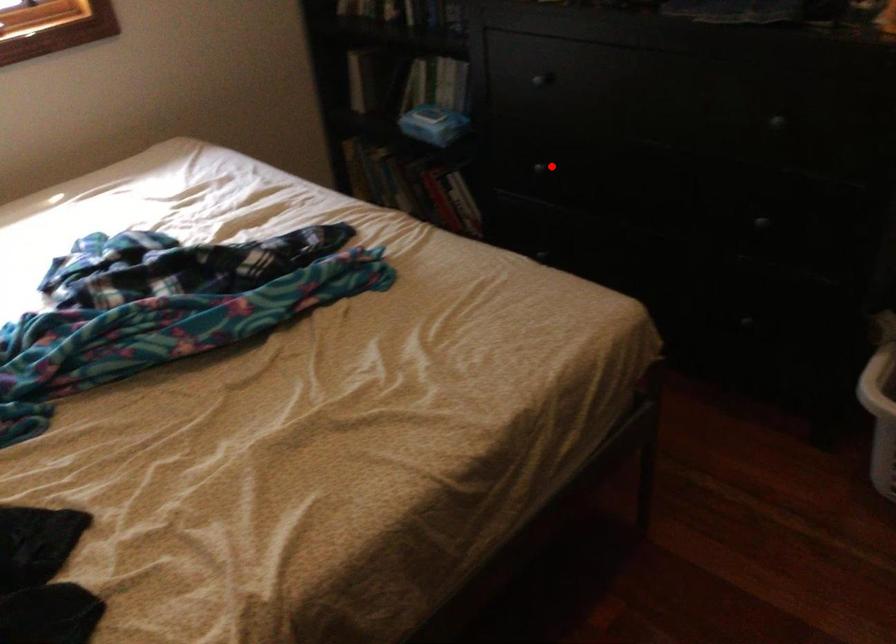
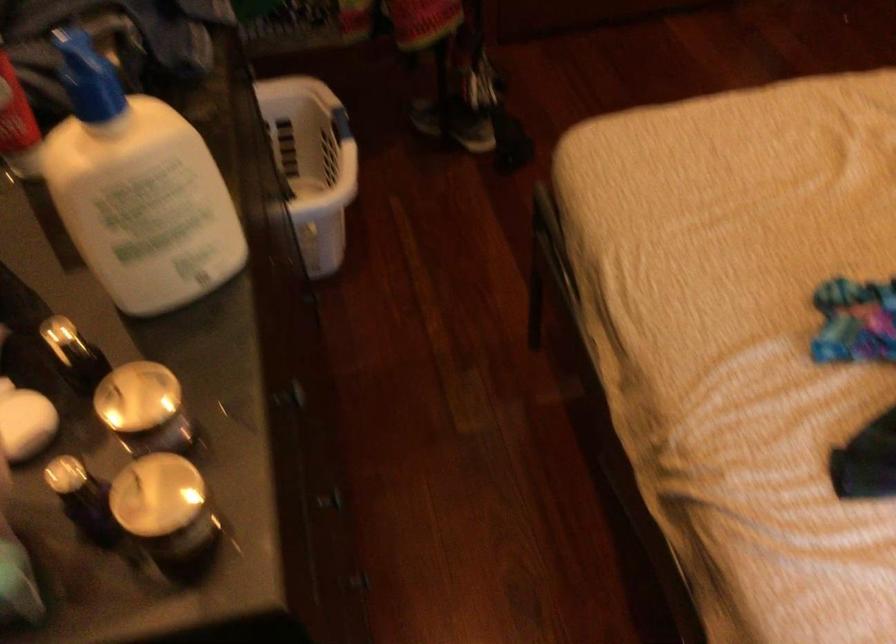
Question: I am providing you with two images of the same scene from different viewpoints. In image1, a red point is highlighted. Considering the same 3D point in image2, which of the following is correct?

Choices:
 (A) It is closer
 (B) It is farther

Answer: (A)